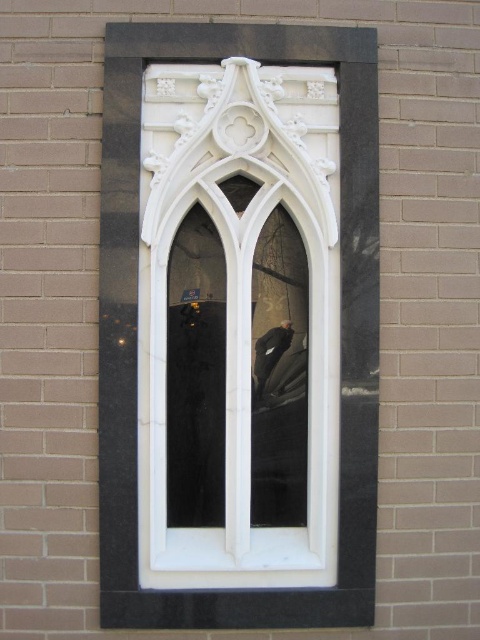
Question: Which point appears closest to the camera in this image?

Choices:
 (A) (276, 364)
 (B) (356, 547)

Answer: (B)

Question: Among these objects, which one is nearest to the camera?

Choices:
 (A) white marble window frame at center
 (B) dark brown leather jacket at center

Answer: (A)

Question: Does white marble window frame at center have a greater width compared to dark brown leather jacket at center?

Choices:
 (A) yes
 (B) no

Answer: (A)

Question: Can you confirm if white marble window frame at center is wider than dark brown leather jacket at center?

Choices:
 (A) yes
 (B) no

Answer: (A)

Question: Which point is closer to the camera?

Choices:
 (A) (365, 596)
 (B) (255, 378)

Answer: (A)

Question: Is white marble window frame at center to the right of dark brown leather jacket at center from the viewer's perspective?

Choices:
 (A) no
 (B) yes

Answer: (A)